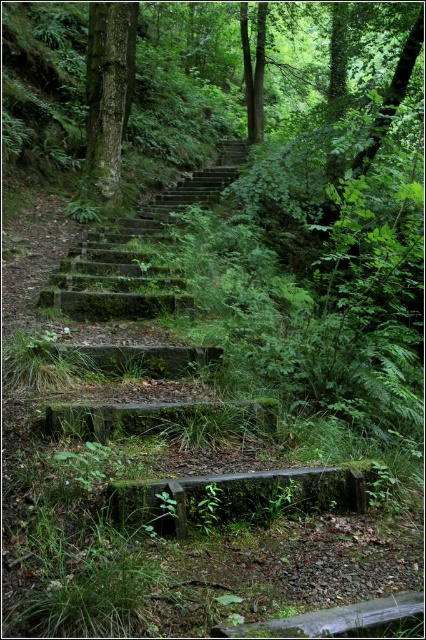
Question: Considering the relative positions of green mossy wood at lower center and green mossy tree trunk at upper left in the image provided, where is green mossy wood at lower center located with respect to green mossy tree trunk at upper left?

Choices:
 (A) below
 (B) above

Answer: (A)

Question: Which point is farther to the camera?

Choices:
 (A) mossy concrete stairs at center
 (B) green mossy tree trunk at upper left
 (C) green mossy wood at lower center

Answer: (B)

Question: Estimate the real-world distances between objects in this image. Which object is farther from the mossy concrete stairs at center?

Choices:
 (A) green mossy wood at lower center
 (B) green mossy tree trunk at upper left

Answer: (A)

Question: Is mossy concrete stairs at center below green mossy wood at lower center?

Choices:
 (A) no
 (B) yes

Answer: (A)

Question: Where is mossy concrete stairs at center located in relation to green mossy wood at lower center in the image?

Choices:
 (A) left
 (B) right

Answer: (A)

Question: Which point appears closest to the camera in this image?

Choices:
 (A) (138, 259)
 (B) (89, 52)
 (C) (296, 474)

Answer: (C)